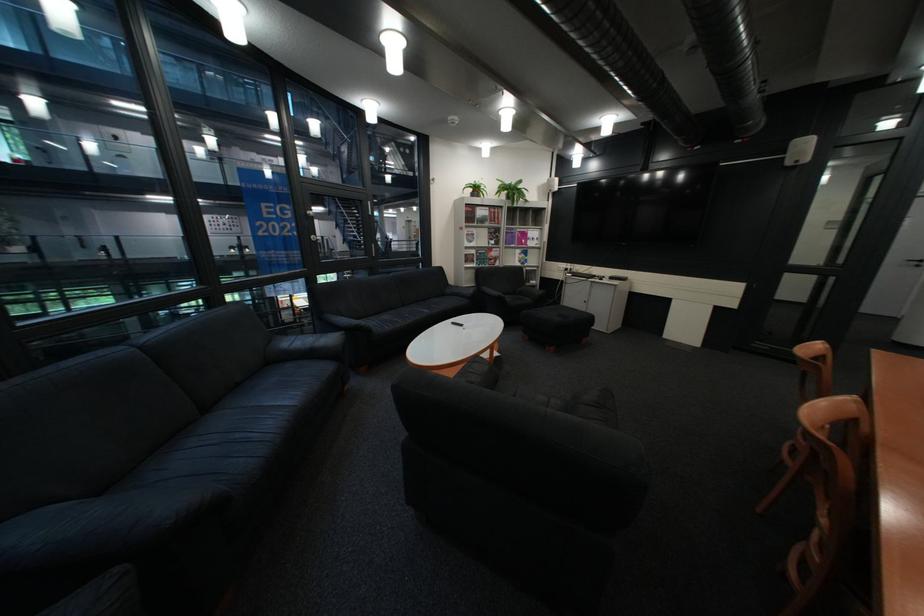
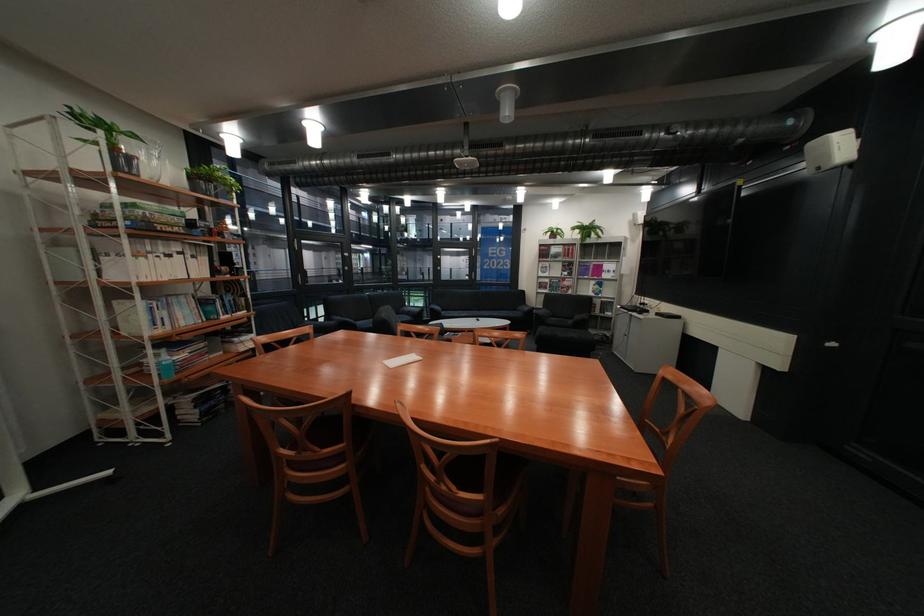
Where in the second image is the point corresponding to (516,183) from the first image?

(594, 225)